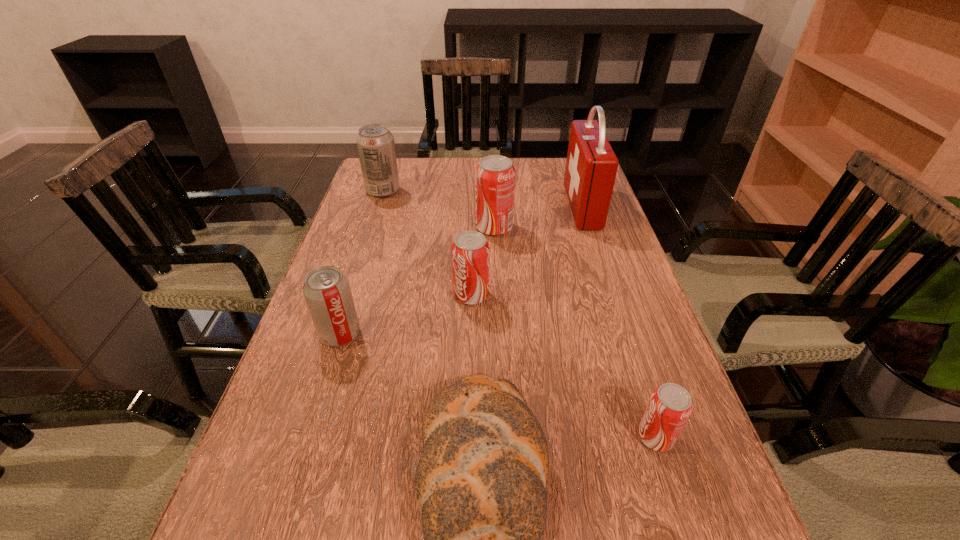
Where is `free location located 0.100m on the logo side of the second farthest red soda can`? This screenshot has height=540, width=960. free location located 0.100m on the logo side of the second farthest red soda can is located at coordinates (533, 295).

Where is `vacant space located 0.090m on the logo side of the nearest red soda can`? The image size is (960, 540). vacant space located 0.090m on the logo side of the nearest red soda can is located at coordinates (584, 437).

At what (x,y) coordinates should I click in order to perform the action: click on free space located 0.350m on the logo side of the nearest red soda can. Please return your answer as a coordinate pair (x, y). Image resolution: width=960 pixels, height=540 pixels. Looking at the image, I should click on (429, 437).

You are a GUI agent. You are given a task and a screenshot of the screen. Output one action in this format:
    pyautogui.click(x=<x>, y=<y>)
    Task: Click on the vacant region located on the logo side of the nearest red soda can
    The height and width of the screenshot is (540, 960).
    Given the screenshot: What is the action you would take?
    pyautogui.click(x=560, y=437)

This screenshot has height=540, width=960. Identify the location of the first-aid kit that is at the far edge. (591, 166).

Locate an element on the screen. soda can that is at the far edge is located at coordinates click(x=375, y=143).

You are a GUI agent. You are given a task and a screenshot of the screen. Output one action in this format:
    pyautogui.click(x=<x>, y=<y>)
    Task: Click on the first-aid kit that is at the right edge
    The width and height of the screenshot is (960, 540).
    Given the screenshot: What is the action you would take?
    pyautogui.click(x=591, y=166)

I want to click on soda can at the right edge, so click(670, 405).

I want to click on object that is at the far left corner, so click(375, 143).

The image size is (960, 540). In order to click on object at the far right corner in this screenshot , I will do `click(591, 166)`.